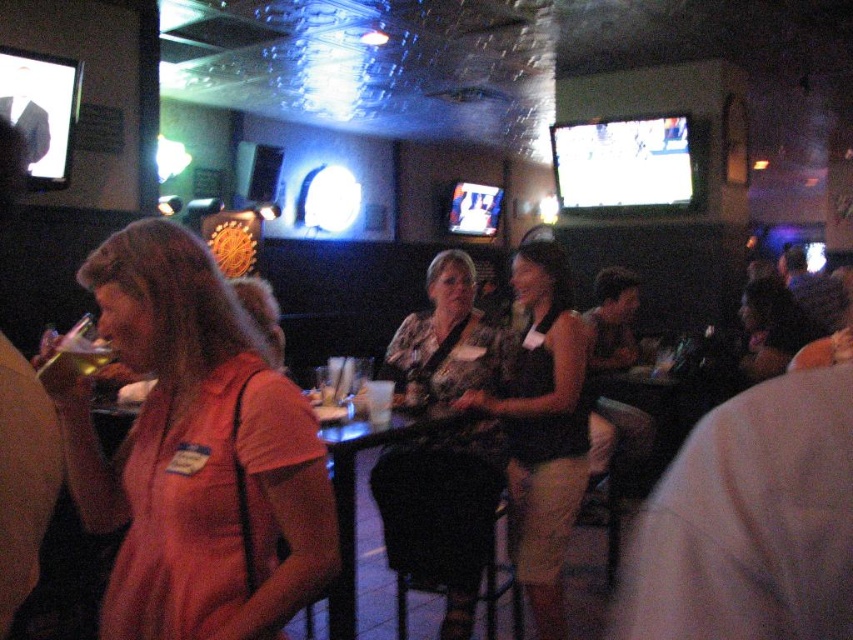
Question: Which point appears closest to the camera in this image?

Choices:
 (A) (543, 292)
 (B) (62, 394)

Answer: (B)

Question: Which object is closer to the camera taking this photo?

Choices:
 (A) floral-patterned blouse at center
 (B) orange fabric shirt at left
 (C) matte black tank top at center

Answer: (B)

Question: Is floral-patterned blouse at center to the left of matte black tank top at center from the viewer's perspective?

Choices:
 (A) yes
 (B) no

Answer: (A)

Question: Estimate the real-world distances between objects in this image. Which object is farther from the orange fabric shirt at left?

Choices:
 (A) matte black tank top at center
 (B) floral-patterned blouse at center

Answer: (A)

Question: Is orange fabric shirt at left further to camera compared to floral-patterned blouse at center?

Choices:
 (A) yes
 (B) no

Answer: (B)

Question: Considering the relative positions of orange fabric shirt at left and floral-patterned blouse at center in the image provided, where is orange fabric shirt at left located with respect to floral-patterned blouse at center?

Choices:
 (A) above
 (B) below

Answer: (A)